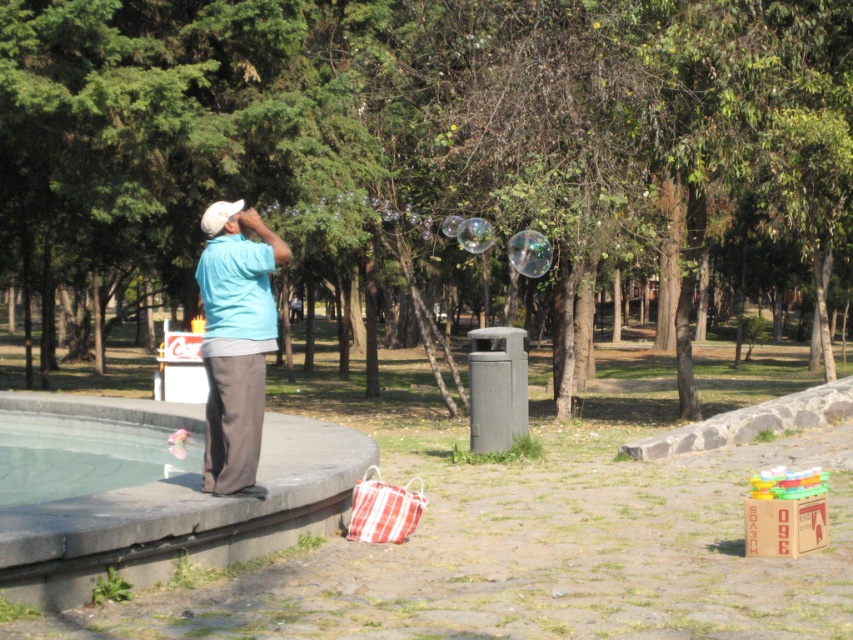
You are a photographer standing at the edge of the transparent glass pool at lower left and want to take a photo of the matte blue shirt at center. Considering their relative heights, which object should you focus on first to ensure proper framing?

The matte blue shirt at center is much taller than the transparent glass pool at lower left, so you should focus on the matte blue shirt at center first to ensure proper framing.

You are a photographer aiming to capture the man in the matte blue shirt at center without the transparent glass pool at lower left reflecting in your shot. Based on their positions, is this possible?

The matte blue shirt at center is closer to the viewer than the transparent glass pool at lower left, so positioning the camera to avoid the reflection from the transparent glass pool at lower left should be possible by angling the shot towards the closer matte blue shirt at center.